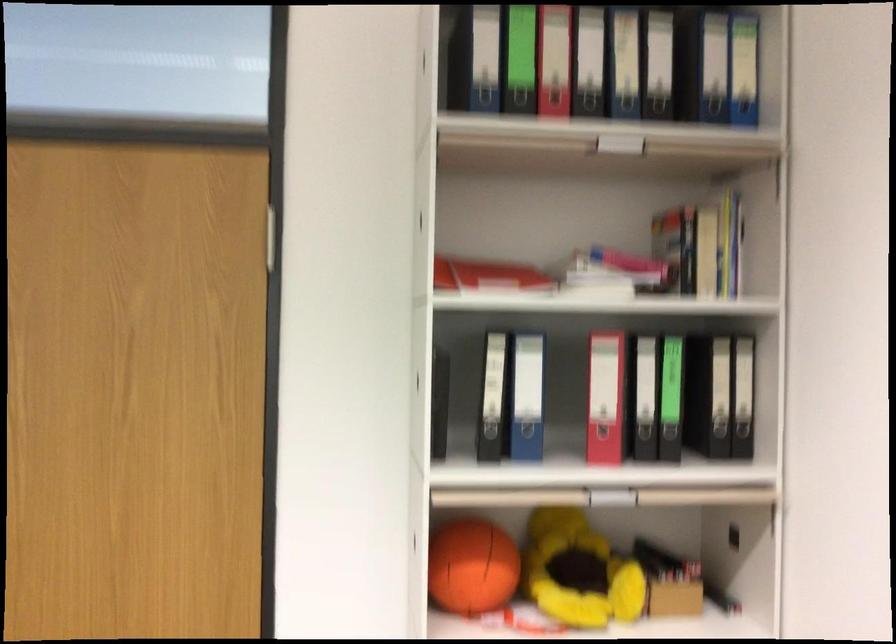
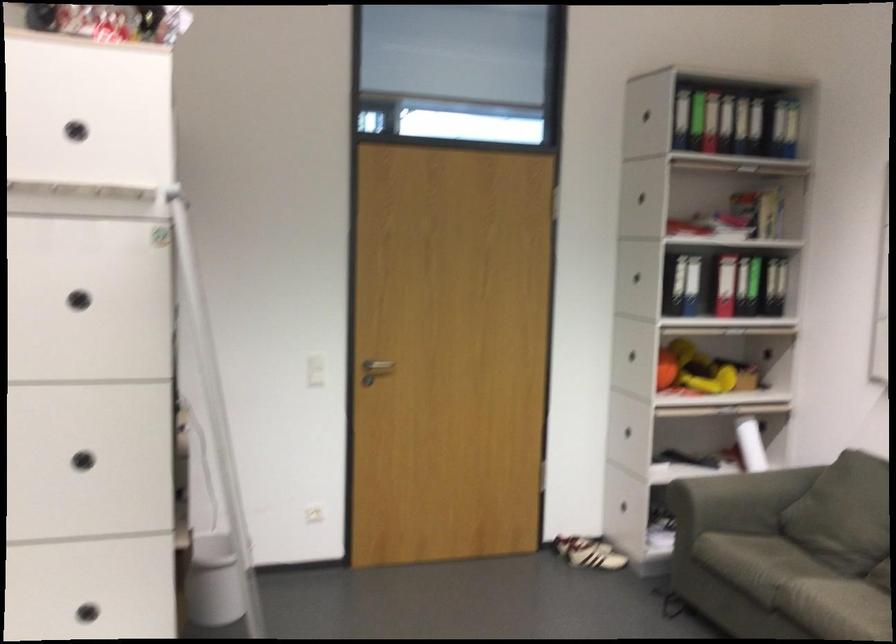
Locate, in the second image, the point that corresponds to [599,426] in the first image.

(725, 285)